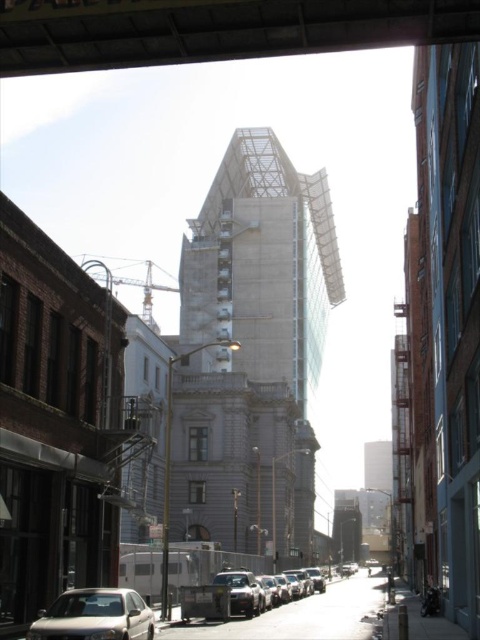
You are driving a metallic silver car at center and want to exit the parking spot. The metallic construction crane at left is blocking your path. Can you safely move forward without hitting the crane?

The metallic silver car at center is positioned under the metallic construction crane at left, so moving forward would risk collision with the crane. You should avoid moving forward to prevent damage.

You are a delivery driver who needs to park your silver metallic sedan at lower left near the metallic glass tower at center. Given the size difference between them, will your car fit in the parking spot next to the tower?

The metallic glass tower at center is larger than the silver metallic sedan at lower left, so the sedan should fit in a standard parking spot next to the tower as cars are typically smaller than large buildings.